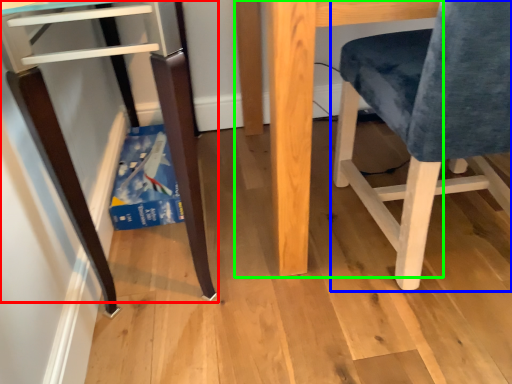
Question: Which object is positioned farthest from furniture (highlighted by a red box)? Select from chair (highlighted by a blue box) and table (highlighted by a green box).

Choices:
 (A) chair
 (B) table

Answer: (A)